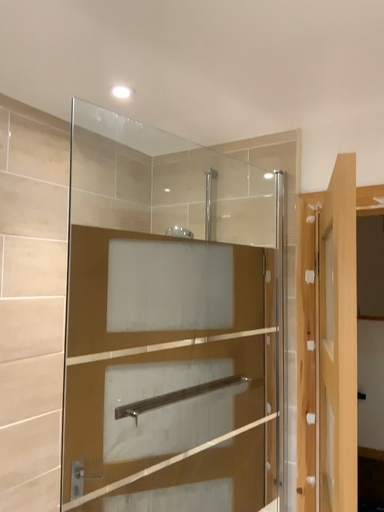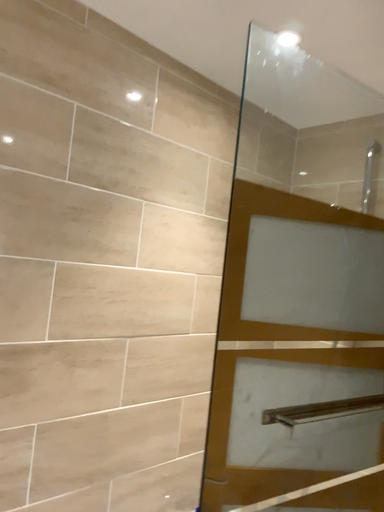
Question: Which way did the camera rotate in the video?

Choices:
 (A) rotated left
 (B) rotated right

Answer: (A)